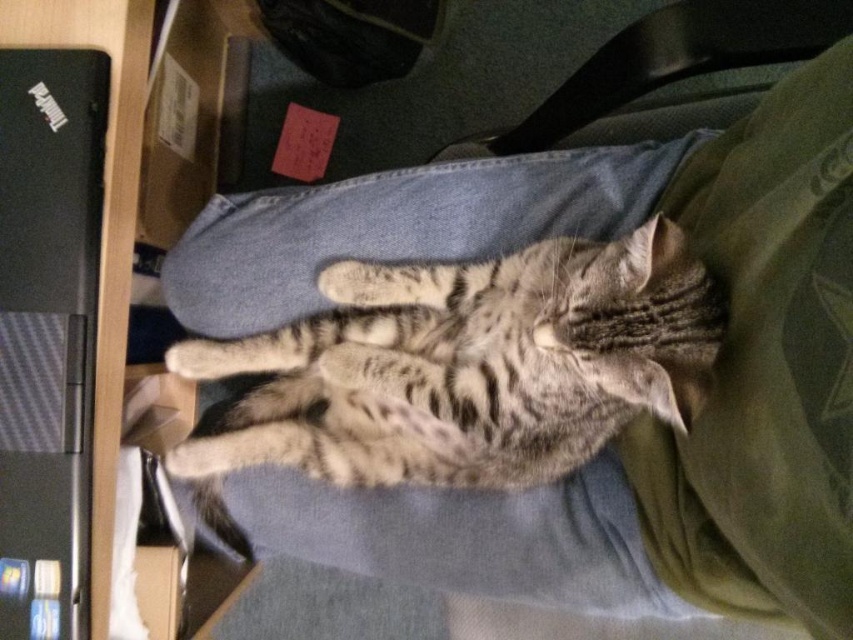
Is tabby fur cat at center wider than black carbon fiber laptop at left?

Indeed, tabby fur cat at center has a greater width compared to black carbon fiber laptop at left.

Can you confirm if tabby fur cat at center is positioned below black carbon fiber laptop at left?

Yes, tabby fur cat at center is below black carbon fiber laptop at left.

The height and width of the screenshot is (640, 853). Identify the location of tabby fur cat at center. (468, 365).